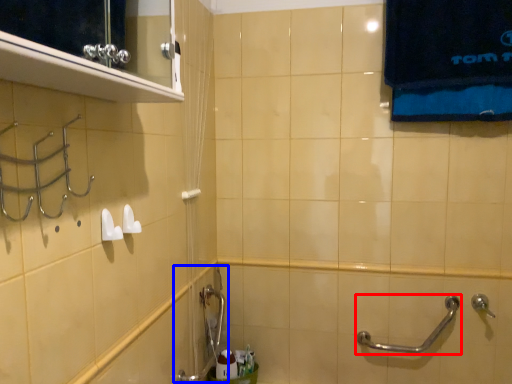
Question: Among these objects, which one is farthest to the camera, door handle (highlighted by a red box) or plumbing fixture (highlighted by a blue box)?

Choices:
 (A) door handle
 (B) plumbing fixture

Answer: (A)